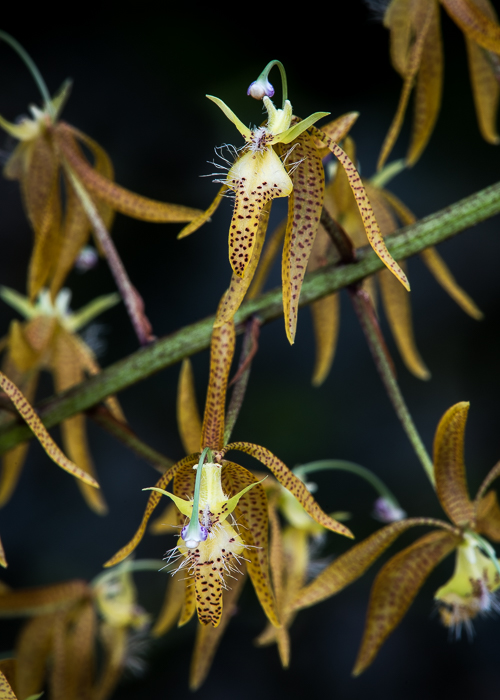
Where is `green plant material`? This screenshot has width=500, height=700. green plant material is located at coordinates (143, 372).